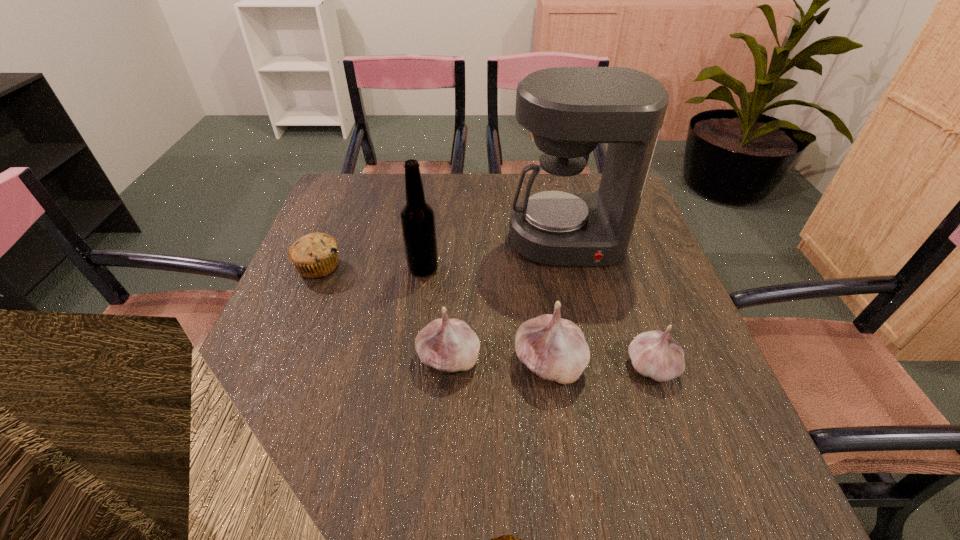
Where is `the leftmost garlic`? This screenshot has height=540, width=960. the leftmost garlic is located at coordinates (449, 345).

Where is `the third shortest object`? the third shortest object is located at coordinates (449, 345).

Image resolution: width=960 pixels, height=540 pixels. Find the location of `the second garlic from left to right`. the second garlic from left to right is located at coordinates (555, 349).

Identify the location of the fifth tallest object. This screenshot has height=540, width=960. click(655, 354).

This screenshot has height=540, width=960. Find the location of `the rightmost garlic`. the rightmost garlic is located at coordinates (655, 354).

Where is `the tallest object`? This screenshot has width=960, height=540. the tallest object is located at coordinates (569, 110).

Find the location of a particular element. beer bottle is located at coordinates (417, 217).

At what (x,y) coordinates should I click in order to perform the action: click on muffin. Please return your answer as a coordinate pair (x, y). The width and height of the screenshot is (960, 540). Looking at the image, I should click on (315, 255).

Locate an element on the screen. The width and height of the screenshot is (960, 540). the leftmost object is located at coordinates pyautogui.click(x=315, y=255).

This screenshot has width=960, height=540. I want to click on vacant space located on the back of the fourth tallest object, so click(x=455, y=249).